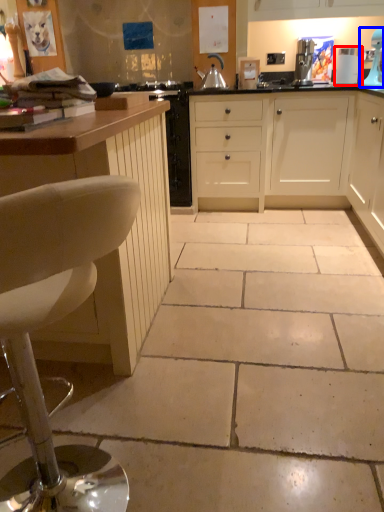
Question: Which of the following is the closest to the observer, appliance (highlighted by a red box) or home appliance (highlighted by a blue box)?

Choices:
 (A) appliance
 (B) home appliance

Answer: (B)